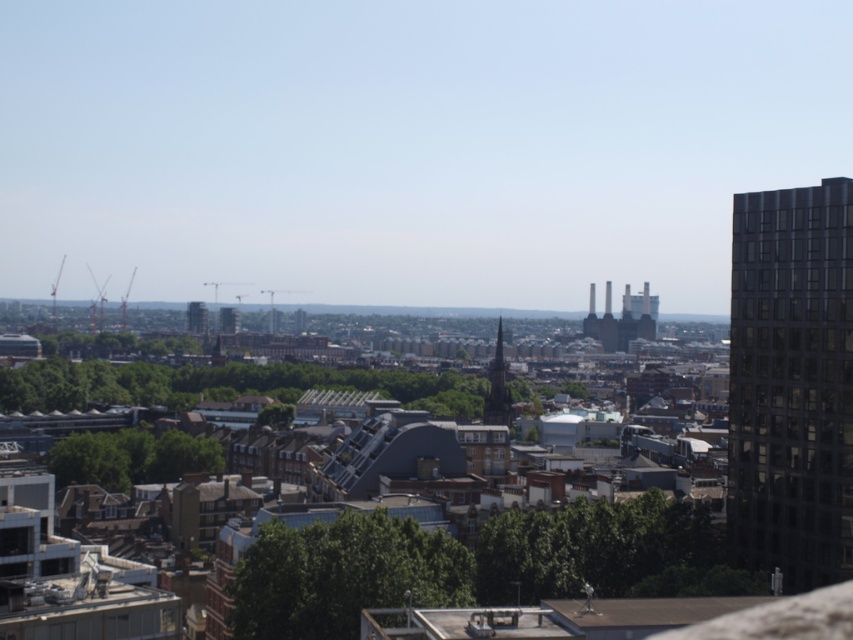
You are an urban planner assessing the cityscape. You need to determine which building, the dark glass building at right or the matte gray building at center, would cast a longer shadow at noon. Based on their heights, which one would it be?

The dark glass building at right is taller than the matte gray building at center, so it would cast a longer shadow at noon.

You are a city planner reviewing a blueprint of an urban area. You notice a point labeled as point (791,381). Based on the scene description, what does this point most likely represent?

The point (791,381) most likely represents the dark glass building at right, as it is the only object explicitly associated with that coordinate in the description.

You are an architect planning to install a new antenna on the narrower structure between the dark gray stone spire at center and the dark gray glass tower at center. Which structure should you choose?

The dark gray stone spire at center has a lesser width compared to the dark gray glass tower at center, so you should choose the dark gray stone spire at center for installing the antenna.